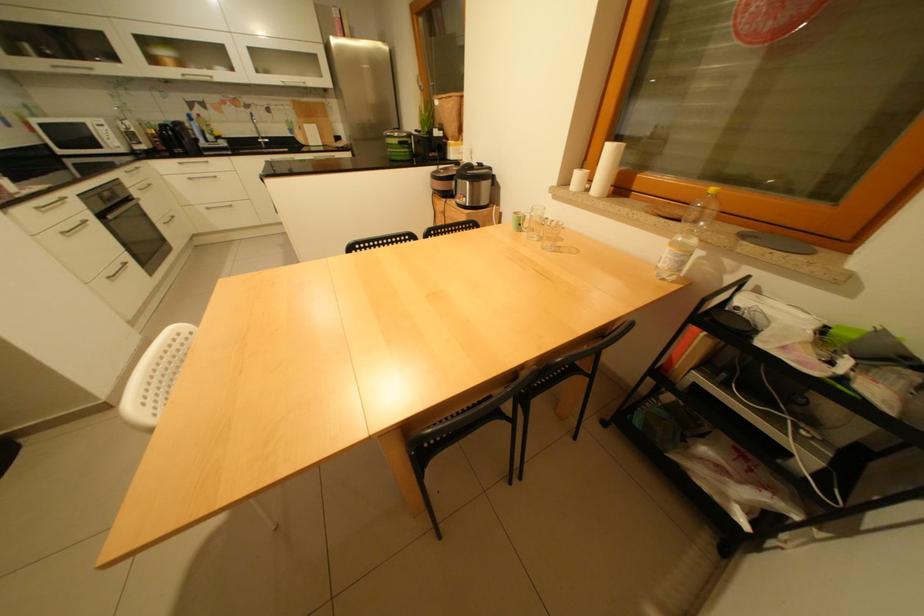
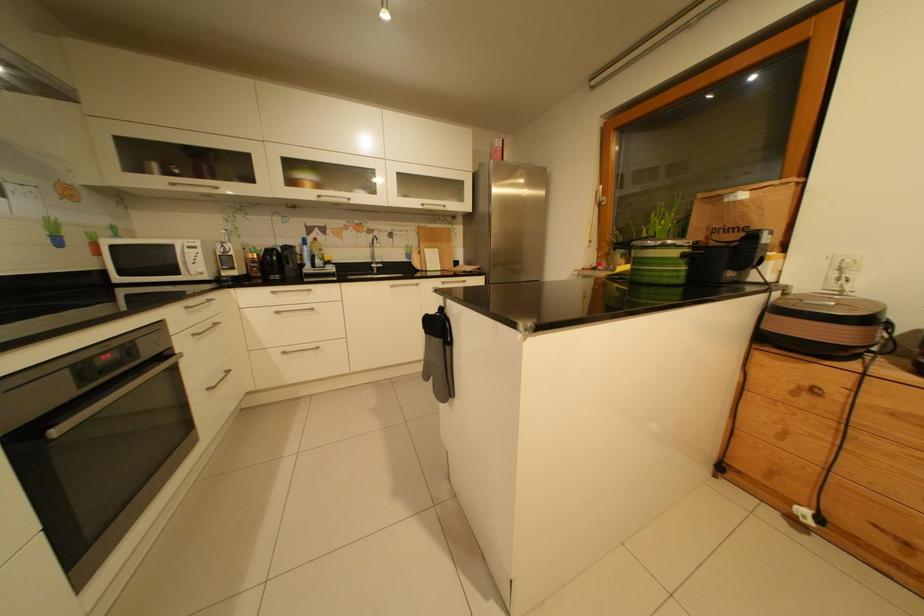
In a continuous first-person perspective shot, in which direction is the camera moving?

A: The cameraman moved toward left, forward.